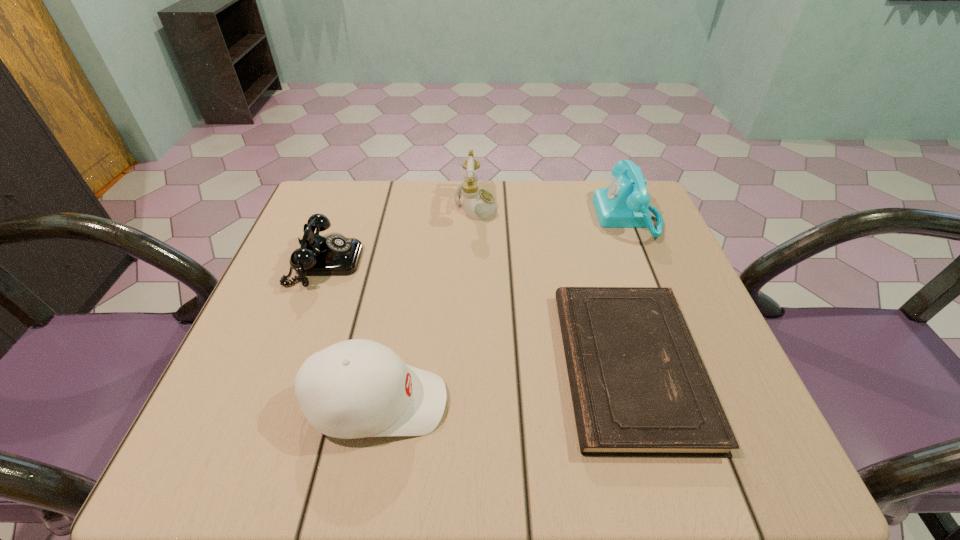
Where is `vacant space positioned on the front-facing side of the baseball cap`? Image resolution: width=960 pixels, height=540 pixels. vacant space positioned on the front-facing side of the baseball cap is located at coordinates (522, 403).

This screenshot has width=960, height=540. I want to click on vacant area situated 0.250m on the dial of the shortest telephone, so click(467, 262).

Where is `vacant region located 0.270m on the back of the paperback book`? vacant region located 0.270m on the back of the paperback book is located at coordinates (588, 221).

The height and width of the screenshot is (540, 960). In order to click on baseball cap at the near edge in this screenshot , I will do `click(358, 388)`.

You are a GUI agent. You are given a task and a screenshot of the screen. Output one action in this format:
    pyautogui.click(x=<x>, y=<y>)
    Task: Click on the paperback book located at the near edge
    The height and width of the screenshot is (540, 960).
    Given the screenshot: What is the action you would take?
    pyautogui.click(x=639, y=388)

I want to click on object that is at the left edge, so click(335, 255).

Identify the location of telephone that is at the right edge. This screenshot has height=540, width=960. (625, 203).

Image resolution: width=960 pixels, height=540 pixels. What are the coordinates of `paperback book that is at the right edge` in the screenshot? It's located at (639, 388).

Locate an element on the screen. The width and height of the screenshot is (960, 540). object at the far right corner is located at coordinates (625, 203).

Locate an element on the screen. object at the near right corner is located at coordinates (639, 388).